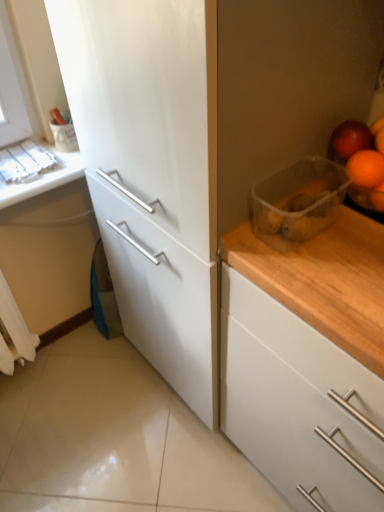
Locate an element on the screen. This screenshot has height=512, width=384. free space in front of transparent plastic container at upper right is located at coordinates (326, 272).